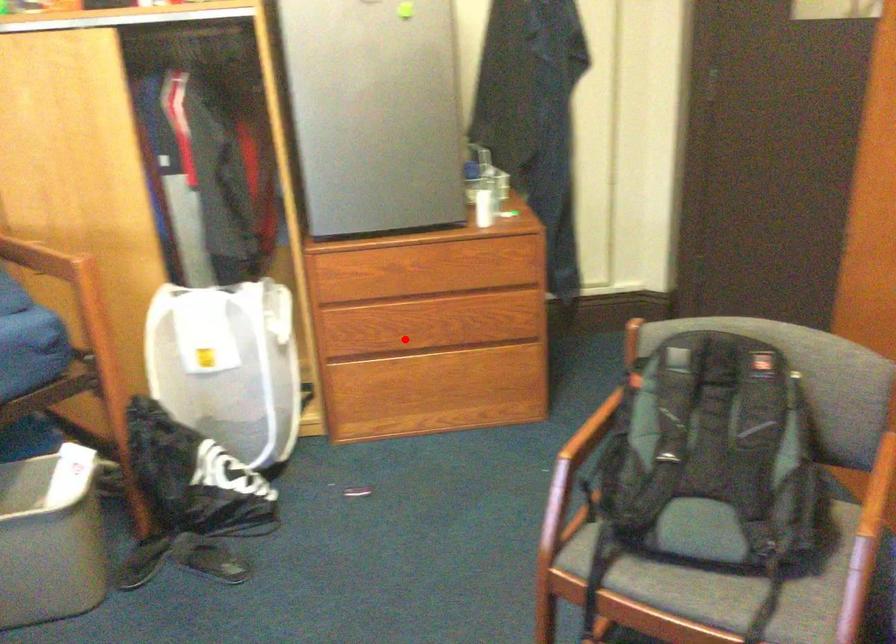
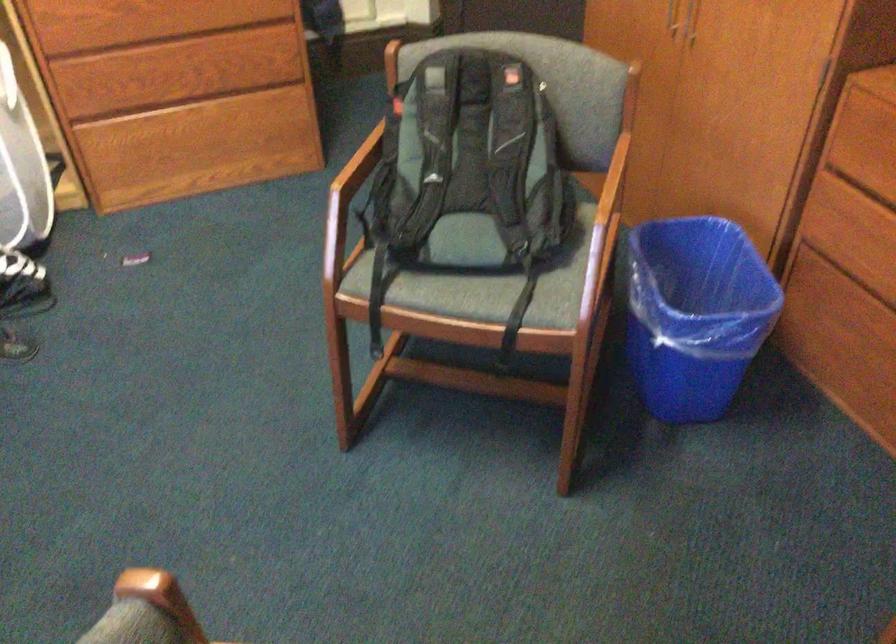
In the second image, find the point that corresponds to the highlighted location in the first image.

(159, 91)